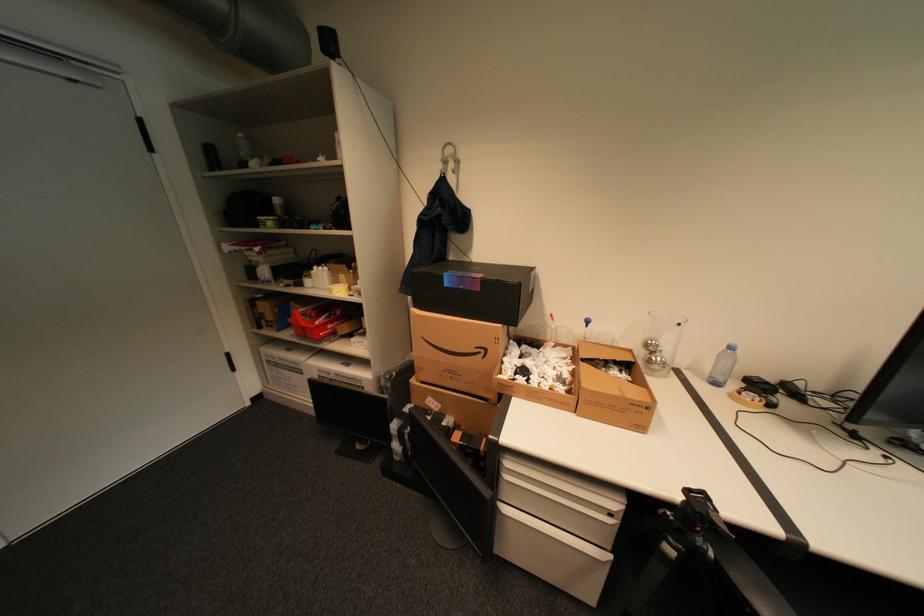
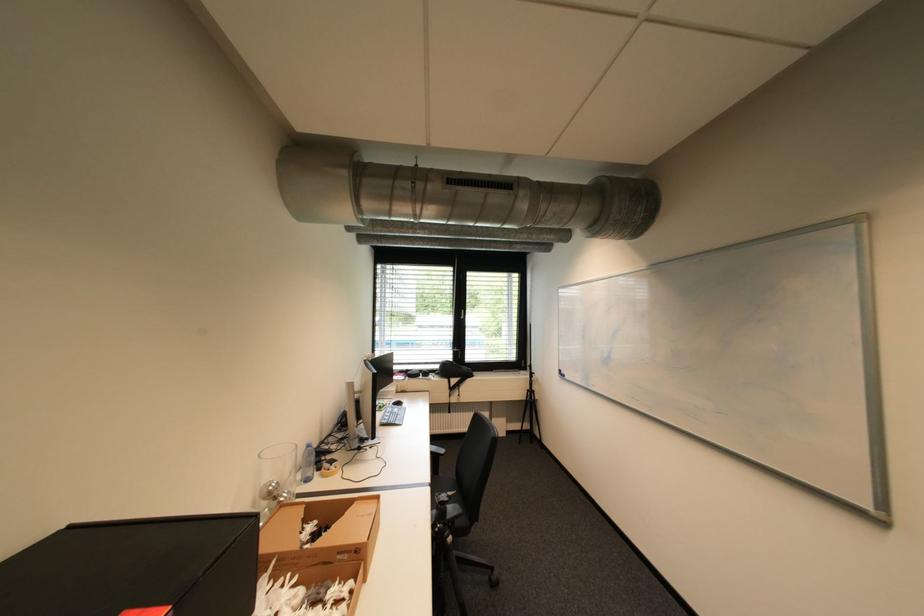
In the second image, find the point that corresponds to the point at 734,347 in the first image.

(313, 448)